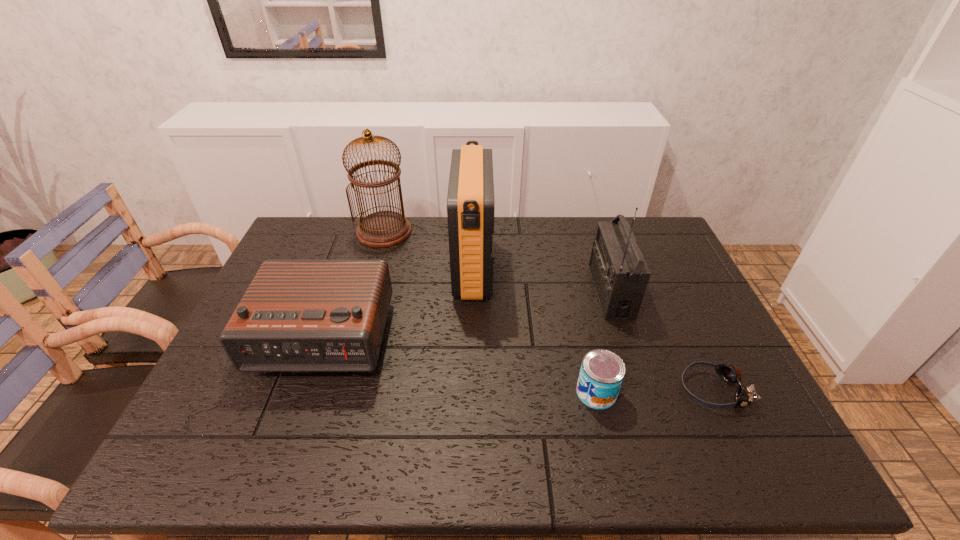
Image resolution: width=960 pixels, height=540 pixels. I want to click on free space that is in between the second object from right to left and the fourth object from right to left, so click(542, 280).

Where is `vacant region between the second object from right to left and the birdcage`? Image resolution: width=960 pixels, height=540 pixels. vacant region between the second object from right to left and the birdcage is located at coordinates (497, 261).

Locate an element on the screen. The width and height of the screenshot is (960, 540). vacant point located between the second radio receiver from left to right and the birdcage is located at coordinates (429, 250).

I want to click on vacant space in between the rightmost object and the birdcage, so click(548, 310).

At what (x,y) coordinates should I click in order to perform the action: click on vacant region between the second radio receiver from left to right and the leftmost radio receiver. Please return your answer as a coordinate pair (x, y). Looking at the image, I should click on (396, 303).

The height and width of the screenshot is (540, 960). I want to click on blank region between the third object from right to left and the rightmost radio receiver, so click(603, 342).

This screenshot has height=540, width=960. Identify the location of empty space that is in between the fifth object from left to right and the third shortest object. (465, 314).

I want to click on unoccupied area between the can and the shortest object, so click(x=655, y=391).

Identify the location of object that stands as the fifth closest to the second radio receiver from left to right. (731, 374).

Identify the location of object that is the fourth nearest to the third object from right to left. (297, 315).